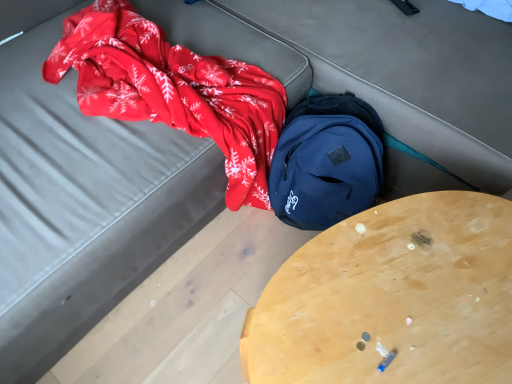
Question: Considering the positions of navy blue backpack at center and wooden table at center in the image, is navy blue backpack at center taller or shorter than wooden table at center?

Choices:
 (A) tall
 (B) short

Answer: (B)

Question: In the image, is navy blue backpack at center positioned in front of or behind wooden table at center?

Choices:
 (A) behind
 (B) front

Answer: (A)

Question: Is navy blue backpack at center spatially inside wooden table at center, or outside of it?

Choices:
 (A) outside
 (B) inside

Answer: (A)

Question: In terms of width, does wooden table at center look wider or thinner when compared to navy blue backpack at center?

Choices:
 (A) thin
 (B) wide

Answer: (B)

Question: From the image's perspective, is wooden table at center located above or below navy blue backpack at center?

Choices:
 (A) above
 (B) below

Answer: (B)

Question: Does point (287, 380) appear closer or farther from the camera than point (335, 127)?

Choices:
 (A) farther
 (B) closer

Answer: (B)

Question: Choose the correct answer: Is wooden table at center inside navy blue backpack at center or outside it?

Choices:
 (A) outside
 (B) inside

Answer: (A)